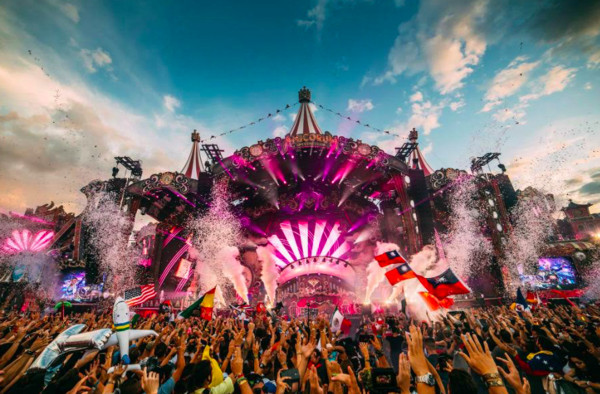
I want to click on purple lights, so click(x=285, y=244), click(x=290, y=238), click(x=301, y=231), click(x=318, y=225), click(x=332, y=235), click(x=343, y=247), click(x=283, y=252).